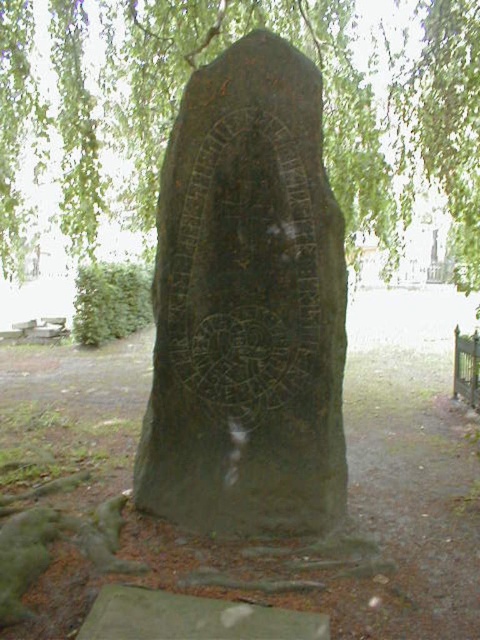
You are standing at the base of the stone monument and see two points marked on the ground. One is labeled as point [196,180] and the other as point [428,406]. If you want to walk towards the point that is closer to you, which point should you head towards?

Point [196,180] is in front of point [428,406], so you should head towards point [196,180] as it is closer to your current position at the base of the stone monument.

You are an archaeologist examining the green stone monument at center and the green stone carving at center. Which object is taller?

The green stone monument at center is taller than the green stone carving at center.

You are standing in a forest clearing and see the green stone monument at center and the green leafy tree at upper center. Which object is positioned higher up in the image?

The green leafy tree at upper center is positioned higher up in the image than the green stone monument at center.